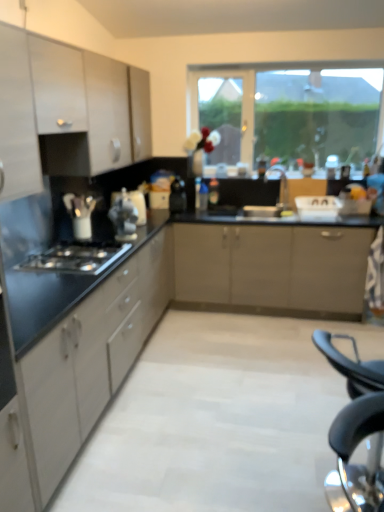
This screenshot has height=512, width=384. What do you see at coordinates (356, 432) in the screenshot?
I see `black plastic folding chair at lower right` at bounding box center [356, 432].

What is the approximate height of translucent plastic bottle at center?

It is 24.03 centimeters.

What do you see at coordinates (178, 196) in the screenshot?
I see `metallic silver kettle at center, positioned as the 1th appliance in right-to-left order` at bounding box center [178, 196].

At what (x,y) coordinates should I click in order to perform the action: click on black plastic folding chair at lower right. Please return your answer as a coordinate pair (x, y). Looking at the image, I should click on (356, 432).

Where is `the 1st appliance behind the matte white cabinet at left, which ranks as the 2th cabinetry in top-to-bottom order, counting from the anchor's position`? the 1st appliance behind the matte white cabinet at left, which ranks as the 2th cabinetry in top-to-bottom order, counting from the anchor's position is located at coordinates (x=124, y=218).

From the picture: Is satin silver kettle at center, placed as the first appliance when sorted from front to back, shorter than matte white cabinet at left, marked as the second cabinetry in a bottom-to-top arrangement?

Correct, satin silver kettle at center, placed as the first appliance when sorted from front to back, is not as tall as matte white cabinet at left, marked as the second cabinetry in a bottom-to-top arrangement.

From a real-world perspective, between satin silver kettle at center, placed as the first appliance when sorted from front to back, and matte white cabinet at left, marked as the second cabinetry in a bottom-to-top arrangement, who is vertically higher?

In real-world perspective, matte white cabinet at left, marked as the second cabinetry in a bottom-to-top arrangement, is above.

Is satin silver kettle at center, the second appliance positioned from the left, not within matte white cabinet at left, marked as the second cabinetry in a bottom-to-top arrangement?

Yes.

Considering the sizes of objects matte white cabinet at left, which ranks as the 2th cabinetry in top-to-bottom order, and transparent glass window at upper center in the image provided, who is smaller, matte white cabinet at left, which ranks as the 2th cabinetry in top-to-bottom order, or transparent glass window at upper center?

With smaller size is transparent glass window at upper center.

Looking at this image, would you say matte white cabinet at left, which ranks as the 2th cabinetry in top-to-bottom order, contains transparent glass window at upper center?

No.

Is matte white cabinet at left, which ranks as the 2th cabinetry in top-to-bottom order, not near transparent glass window at upper center?

Yes, matte white cabinet at left, which ranks as the 2th cabinetry in top-to-bottom order, and transparent glass window at upper center are quite far apart.

Between matte white cabinet at left, which ranks as the 2th cabinetry in top-to-bottom order, and transparent glass window at upper center, which one appears on the right side from the viewer's perspective?

transparent glass window at upper center.

Which of these two, black plastic folding chair at lower right or satin silver cabinet at upper left, marked as the 3th cabinetry in a bottom-to-top arrangement, stands shorter?

satin silver cabinet at upper left, marked as the 3th cabinetry in a bottom-to-top arrangement.

From the image's perspective, is black plastic folding chair at lower right above satin silver cabinet at upper left, the 1th cabinetry viewed from the top?

Actually, black plastic folding chair at lower right appears below satin silver cabinet at upper left, the 1th cabinetry viewed from the top, in the image.

From a real-world perspective, is black plastic folding chair at lower right physically above satin silver cabinet at upper left, the 1th cabinetry viewed from the top?

No, from a real-world perspective, black plastic folding chair at lower right is not above satin silver cabinet at upper left, the 1th cabinetry viewed from the top.

Are black plastic folding chair at lower right and satin silver cabinet at upper left, marked as the 3th cabinetry in a bottom-to-top arrangement, located far from each other?

Yes, black plastic folding chair at lower right and satin silver cabinet at upper left, marked as the 3th cabinetry in a bottom-to-top arrangement, are quite far apart.

Which object is wider, matte black countertop at left, which ranks as the first cabinetry in bottom-to-top order, or black plastic folding chair at lower right?

With larger width is matte black countertop at left, which ranks as the first cabinetry in bottom-to-top order.

Is the position of matte black countertop at left, which ranks as the first cabinetry in bottom-to-top order, more distant than that of black plastic folding chair at lower right?

Yes.

At what (x,y) coordinates should I click in order to perform the action: click on folding chair on the right of matte black countertop at left, which ranks as the first cabinetry in bottom-to-top order. Please return your answer as a coordinate pair (x, y). This screenshot has width=384, height=512. Looking at the image, I should click on (356, 432).

From a real-world perspective, between matte white cabinet at left, which ranks as the 2th cabinetry in top-to-bottom order, and translucent plastic bottle at center, who is vertically higher?

In real-world perspective, matte white cabinet at left, which ranks as the 2th cabinetry in top-to-bottom order, is above.

Between matte white cabinet at left, which ranks as the 2th cabinetry in top-to-bottom order, and translucent plastic bottle at center, which one has larger size?

Bigger between the two is matte white cabinet at left, which ranks as the 2th cabinetry in top-to-bottom order.

Is matte white cabinet at left, marked as the second cabinetry in a bottom-to-top arrangement, shorter than translucent plastic bottle at center?

No.

Considering the sizes of objects matte white cabinet at left, marked as the second cabinetry in a bottom-to-top arrangement, and translucent plastic bottle at center in the image provided, who is wider, matte white cabinet at left, marked as the second cabinetry in a bottom-to-top arrangement, or translucent plastic bottle at center?

matte white cabinet at left, marked as the second cabinetry in a bottom-to-top arrangement, is wider.

Locate an element on the screen. bottle behind the satin silver cabinet at upper left, marked as the 3th cabinetry in a bottom-to-top arrangement is located at coordinates (203, 197).

Is satin silver cabinet at upper left, marked as the 3th cabinetry in a bottom-to-top arrangement, in contact with translucent plastic bottle at center?

No, satin silver cabinet at upper left, marked as the 3th cabinetry in a bottom-to-top arrangement, is not touching translucent plastic bottle at center.

Is translucent plastic bottle at center inside satin silver cabinet at upper left, the 1th cabinetry viewed from the top?

Actually, translucent plastic bottle at center is outside satin silver cabinet at upper left, the 1th cabinetry viewed from the top.

Is metallic silver kettle at center, marked as the fourth appliance in a left-to-right arrangement, at the back of white glossy kettle at left, arranged as the 1th appliance when viewed from the left?

No, white glossy kettle at left, arranged as the 1th appliance when viewed from the left, is not facing away from metallic silver kettle at center, marked as the fourth appliance in a left-to-right arrangement.

Who is smaller, white glossy kettle at left, which appears as the second appliance when viewed from the front, or metallic silver kettle at center, marked as the fourth appliance in a left-to-right arrangement?

With smaller size is white glossy kettle at left, which appears as the second appliance when viewed from the front.

From the image's perspective, starting from the white glossy kettle at left, which appears as the third appliance when viewed from the back, which appliance is the 3rd one above? Please provide its 2D coordinates.

[(178, 196)]

Does point (91, 239) lie in front of point (178, 199)?

Yes.

At what (x,y) coordinates should I click in order to perform the action: click on the 3rd appliance positioned below the matte white cabinet at left, marked as the second cabinetry in a bottom-to-top arrangement (from the image's perspective). Please return your answer as a coordinate pair (x, y). Image resolution: width=384 pixels, height=512 pixels. Looking at the image, I should click on (124, 218).

The image size is (384, 512). In order to click on window on the right of the matte white cabinet at left, marked as the second cabinetry in a bottom-to-top arrangement in this screenshot , I will do `click(288, 113)`.

Considering their positions, is white glossy kettle at center, placed as the second appliance when sorted from right to left, positioned further to black plastic folding chair at lower right than translucent plastic bottle at center?

translucent plastic bottle at center is further to black plastic folding chair at lower right.

Estimate the real-world distances between objects in this image. Which object is closer to metallic silver kettle at center, positioned as the 1th appliance in right-to-left order, black matte gas stove at lower left or white glossy kettle at left, which appears as the third appliance when viewed from the back?

The object closer to metallic silver kettle at center, positioned as the 1th appliance in right-to-left order, is white glossy kettle at left, which appears as the third appliance when viewed from the back.

Looking at the image, which one is located further to matte black countertop at left, which ranks as the first cabinetry in bottom-to-top order, metallic silver kettle at center, the 1th appliance when ordered from back to front, or matte silver faucet at center?

Among the two, matte silver faucet at center is located further to matte black countertop at left, which ranks as the first cabinetry in bottom-to-top order.

From the image, which object appears to be nearer to metallic silver kettle at center, positioned as the 1th appliance in right-to-left order, satin silver cabinet at upper left, the 1th cabinetry viewed from the top, or satin silver kettle at center, placed as the first appliance when sorted from front to back?

satin silver kettle at center, placed as the first appliance when sorted from front to back, is positioned closer to the anchor metallic silver kettle at center, positioned as the 1th appliance in right-to-left order.

From the image, which object appears to be nearer to white glossy kettle at left, which appears as the fourth appliance when viewed from the right, translucent plastic bottle at center or satin silver cabinet at upper left, the 1th cabinetry viewed from the top?

satin silver cabinet at upper left, the 1th cabinetry viewed from the top.

Looking at this image, from the image, which object appears to be nearer to matte silver faucet at center, metallic silver kettle at center, the 1th appliance when ordered from back to front, or translucent plastic bottle at center?

translucent plastic bottle at center lies closer to matte silver faucet at center than the other object.

Considering their positions, is metallic silver kettle at center, marked as the fourth appliance in a left-to-right arrangement, positioned closer to satin silver kettle at center, which is counted as the 3th appliance, starting from the right, than white glossy kettle at center, which is counted as the 3th appliance, starting from the left?

Based on the image, white glossy kettle at center, which is counted as the 3th appliance, starting from the left, appears to be nearer to satin silver kettle at center, which is counted as the 3th appliance, starting from the right.

Considering their positions, is matte white cabinet at left, which ranks as the 2th cabinetry in top-to-bottom order, positioned further to matte silver faucet at center than black plastic folding chair at lower right?

The object further to matte silver faucet at center is black plastic folding chair at lower right.

Identify the location of cabinetry located between matte black countertop at left, which ranks as the first cabinetry in bottom-to-top order, and metallic silver kettle at center, the 1th appliance when ordered from back to front, in the depth direction. The image size is (384, 512). (57, 87).

You are a GUI agent. You are given a task and a screenshot of the screen. Output one action in this format:
    pyautogui.click(x=<x>, y=<y>)
    Task: Click on the gas stove positioned between satin silver cabinet at upper left, the 1th cabinetry viewed from the top, and metallic silver kettle at center, acting as the fourth appliance starting from the front, from near to far
    
    Given the screenshot: What is the action you would take?
    pyautogui.click(x=76, y=258)

The image size is (384, 512). What are the coordinates of `gas stove that lies between satin silver cabinet at upper left, the 1th cabinetry viewed from the top, and black plastic folding chair at lower right from top to bottom` in the screenshot? It's located at (76, 258).

Where is `gas stove between matte black countertop at left, arranged as the third cabinetry when viewed from the top, and transparent glass window at upper center, along the z-axis`? gas stove between matte black countertop at left, arranged as the third cabinetry when viewed from the top, and transparent glass window at upper center, along the z-axis is located at coordinates (76, 258).